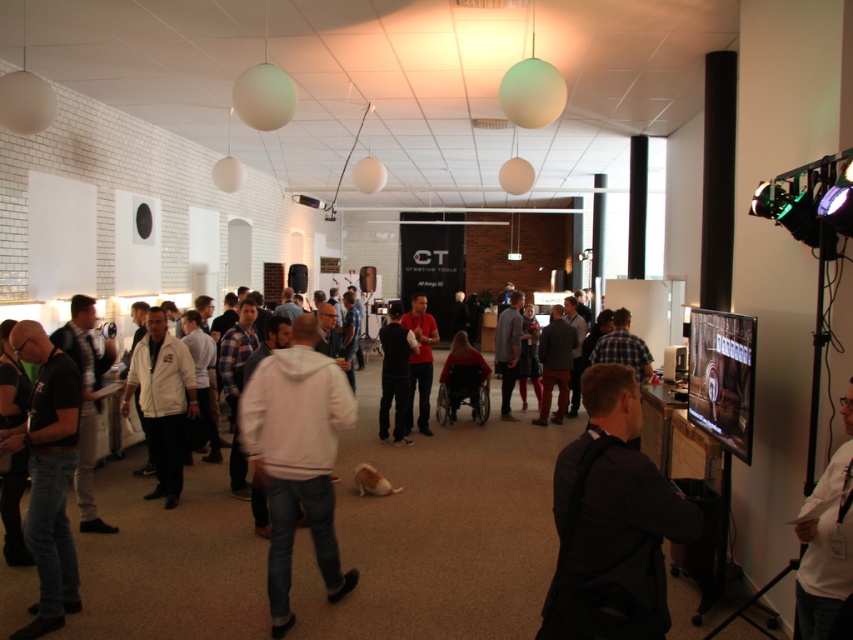
Identify the location of black leather jacket at lower right. (612, 522).

Locate an element on the screen. The height and width of the screenshot is (640, 853). black leather jacket at lower right is located at coordinates (612, 522).

Is point (395, 380) in front of point (511, 380)?

Yes, point (395, 380) is in front of point (511, 380).

Who is lower down, dark gray hoodie at center or dark gray sweater at center?

dark gray hoodie at center

Which is behind, point (389, 400) or point (518, 301)?

Point (518, 301)

This screenshot has width=853, height=640. I want to click on dark gray hoodie at center, so click(395, 372).

Does white fleece jacket at center appear over white matte jacket at center?

Actually, white fleece jacket at center is below white matte jacket at center.

Who is more forward, (306, 445) or (164, 444)?

Point (306, 445) is more forward.

The image size is (853, 640). What do you see at coordinates (297, 456) in the screenshot?
I see `white fleece jacket at center` at bounding box center [297, 456].

Where is `white fleece jacket at center`? The image size is (853, 640). white fleece jacket at center is located at coordinates (297, 456).